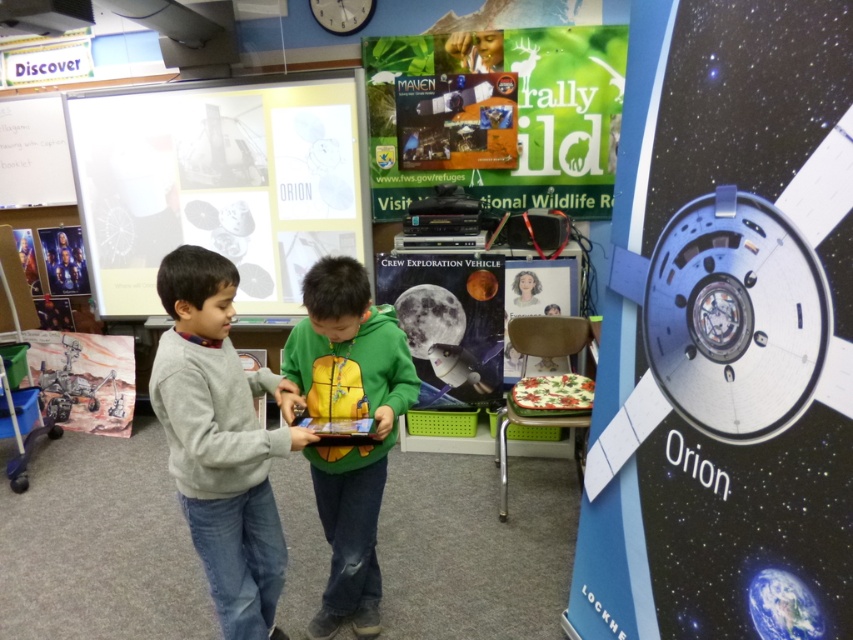
You are a visitor in the classroom and want to see both the white paper at upper center and the metallic silver spaceship at center. Which object will you need to look past first?

You will need to look past the white paper at upper center first because the metallic silver spaceship at center is behind it.

You are a visitor in the classroom and want to take a photo of the metallic silver spaceship at center without the matte cardboard poster at center blocking the view. Based on their positions, is this possible?

The metallic silver spaceship at center might be wider than the matte cardboard poster at center, so it is possible that the spaceship extends beyond the poster, allowing you to take a photo of it without the poster blocking the view.